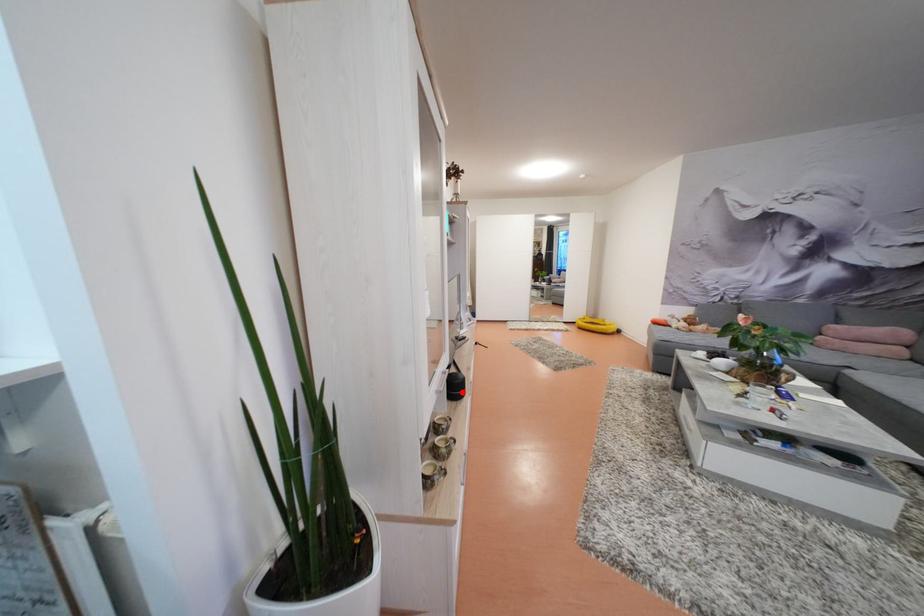
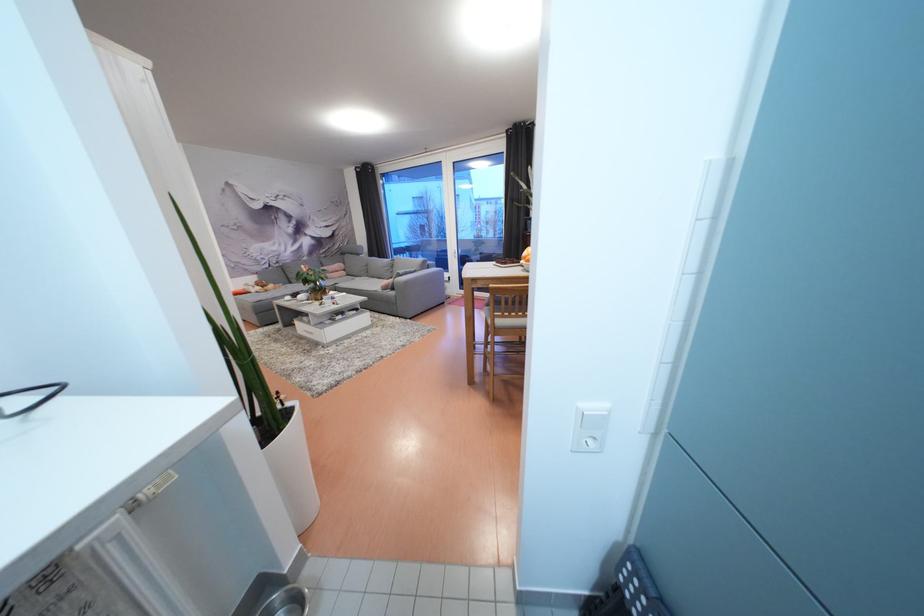
Question: I am providing you with two images of the same scene from different viewpoints. A red point is marked on the first image. Is the red point's position out of view in image 2?

Choices:
 (A) Yes
 (B) No

Answer: (A)